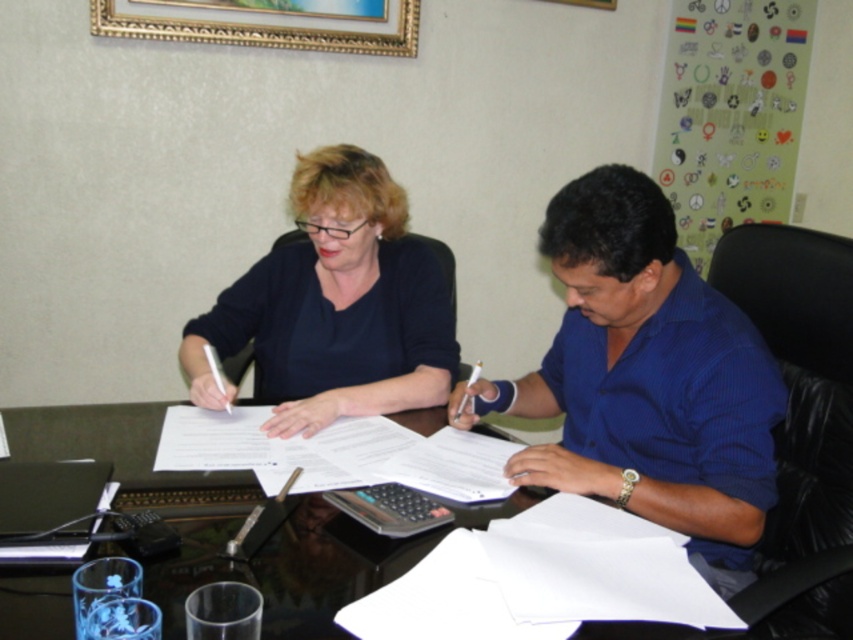
Does white paper at center have a lesser width compared to gold-framed picture at upper center?

Yes.

Which is in front, point (498, 445) or point (378, 10)?

Positioned in front is point (498, 445).

The image size is (853, 640). Find the location of `white paper at center`. white paper at center is located at coordinates (335, 452).

Between point (19, 589) and point (294, 456), which one is positioned behind?

Point (294, 456)

Can you confirm if black glass table at center is bigger than white paper at center?

Indeed, black glass table at center has a larger size compared to white paper at center.

Identify the location of black glass table at center. Image resolution: width=853 pixels, height=640 pixels. (234, 522).

Locate an element on the screen. The image size is (853, 640). black glass table at center is located at coordinates (234, 522).

This screenshot has width=853, height=640. Identify the location of blue shirt at center. (646, 380).

Is point (755, 401) closer to camera compared to point (287, 618)?

No.

Who is more distant from viewer, (584, 352) or (155, 484)?

Positioned behind is point (584, 352).

This screenshot has width=853, height=640. What are the coordinates of `blue shirt at center` in the screenshot? It's located at (646, 380).